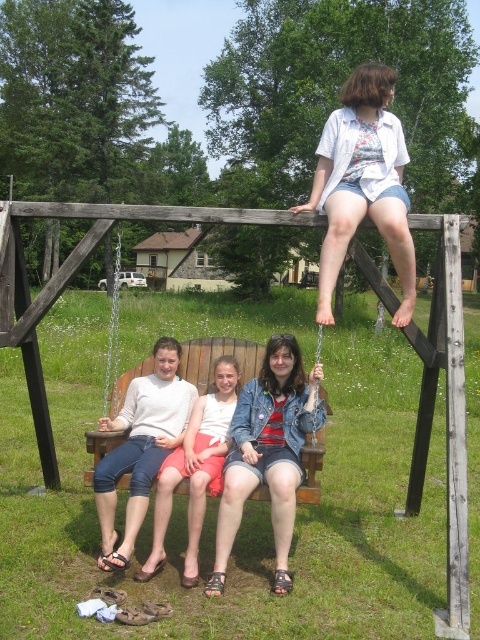
Is matte white sweater at center thinner than denim shorts at center?

No, matte white sweater at center is not thinner than denim shorts at center.

Who is taller, matte white sweater at center or denim shorts at center?

matte white sweater at center is taller.

Image resolution: width=480 pixels, height=640 pixels. Identify the location of matte white sweater at center. (243, 458).

What do you see at coordinates (362, 182) in the screenshot? Image resolution: width=480 pixels, height=640 pixels. I see `white floral shirt at upper center` at bounding box center [362, 182].

Between white floral shirt at upper center and denim shorts at center, which one has more height?

white floral shirt at upper center

Does point (342, 252) lie in front of point (187, 477)?

No, it is behind (187, 477).

Find the location of a particular element. white floral shirt at upper center is located at coordinates (362, 182).

Does matte white sweater at center appear on the left side of denim shorts at lower left?

Incorrect, matte white sweater at center is not on the left side of denim shorts at lower left.

Which of these two, matte white sweater at center or denim shorts at lower left, stands taller?

matte white sweater at center is taller.

Who is more forward, (298, 456) or (129, 404)?

Positioned in front is point (298, 456).

Locate an element on the screen. The image size is (480, 640). matte white sweater at center is located at coordinates (243, 458).